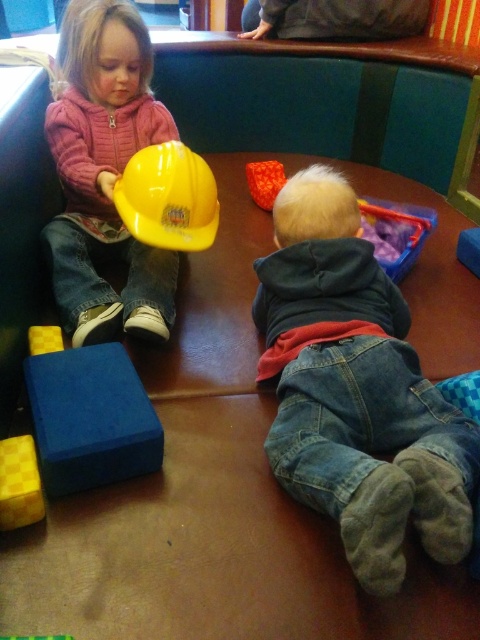
You need to place a rectangular box that is 1.2 meters wide on the bench. Which object, denim jeans at lower right or blue foam block at lower left, has enough space to accommodate the box?

The denim jeans at lower right has a width larger than the blue foam block at lower left, so the box can be placed on the denim jeans at lower right.

You are a toy engineer designing a storage box for the yellow hard hat at left. The storage box must be placed at point 0.309, 0.352. What is the exact coordinate where you should position the storage box?

The yellow hard hat at left is located at point (168, 196), so the storage box should be positioned at those exact coordinates to store it properly.